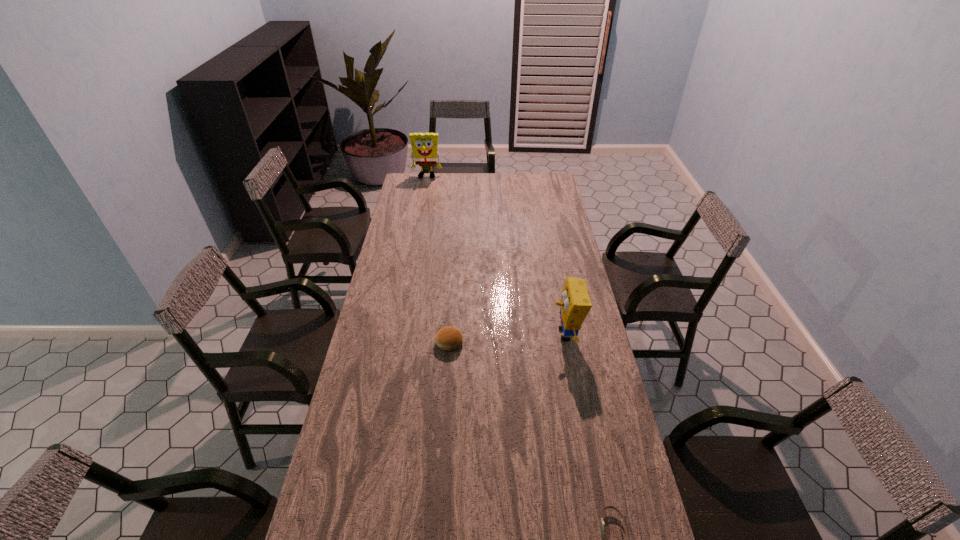
Find the location of a particular element. the farther sponge is located at coordinates (424, 145).

Identify the location of the left sponge. (424, 145).

The width and height of the screenshot is (960, 540). What are the coordinates of `the nearer sponge` in the screenshot? It's located at (575, 304).

This screenshot has height=540, width=960. Identify the location of the third object from right to left. (450, 339).

Locate an element on the screen. patty is located at coordinates (450, 339).

Where is `free space located 0.190m on the face of the left sponge`? Image resolution: width=960 pixels, height=540 pixels. free space located 0.190m on the face of the left sponge is located at coordinates (422, 197).

I want to click on vacant space located 0.200m on the face of the nearer sponge, so click(x=498, y=334).

Identify the location of free spot located on the face of the nearer sponge. The width and height of the screenshot is (960, 540). (512, 334).

Find the location of a particular element. The image size is (960, 540). vacant region located 0.360m on the face of the nearer sponge is located at coordinates (457, 334).

Locate an element on the screen. free region located on the back of the third object from right to left is located at coordinates (453, 286).